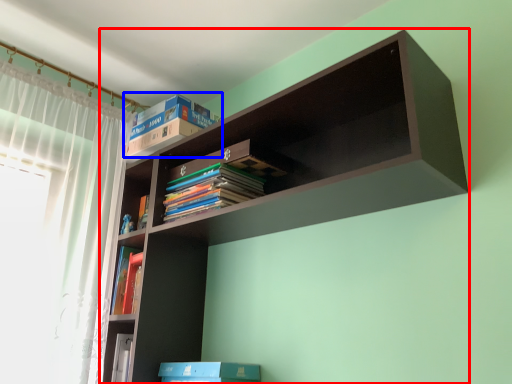
Question: Among these objects, which one is nearest to the camera, shelf (highlighted by a red box) or book (highlighted by a blue box)?

Choices:
 (A) shelf
 (B) book

Answer: (A)